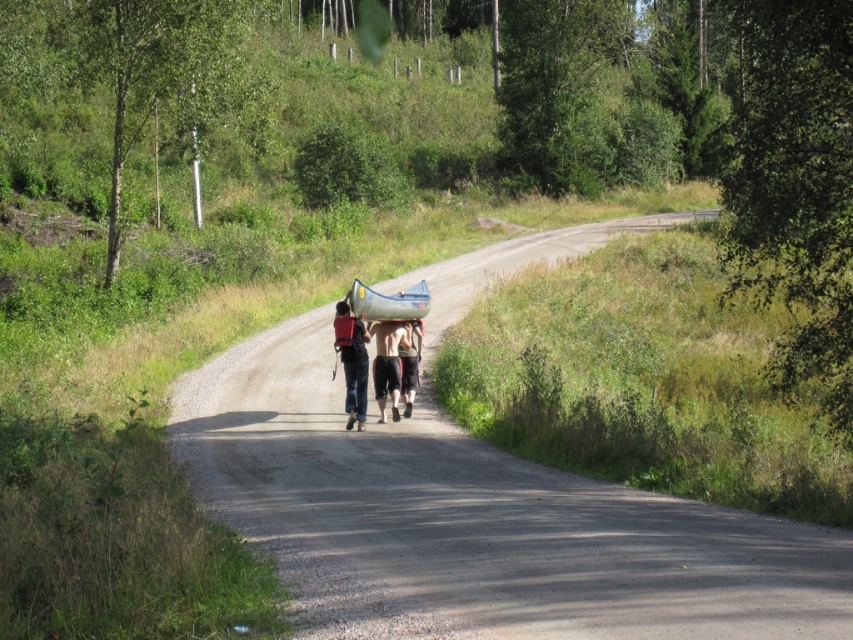
Question: Can you confirm if smooth asphalt road at center is smaller than matte blue jeans at center?

Choices:
 (A) no
 (B) yes

Answer: (A)

Question: Does matte blue jeans at center appear under green rubber canoe at center?

Choices:
 (A) yes
 (B) no

Answer: (A)

Question: Among these objects, which one is nearest to the camera?

Choices:
 (A) matte blue jeans at center
 (B) tan cotton shorts at center
 (C) green rubber canoe at center

Answer: (A)

Question: Which point appears closest to the camera in this image?

Choices:
 (A) (366, 312)
 (B) (408, 333)
 (C) (346, 340)

Answer: (C)

Question: Considering the real-world distances, which object is closest to the matte blue jeans at center?

Choices:
 (A) smooth asphalt road at center
 (B) skinny jeans at center

Answer: (B)

Question: Does matte blue jeans at center appear on the left side of skinny jeans at center?

Choices:
 (A) yes
 (B) no

Answer: (A)